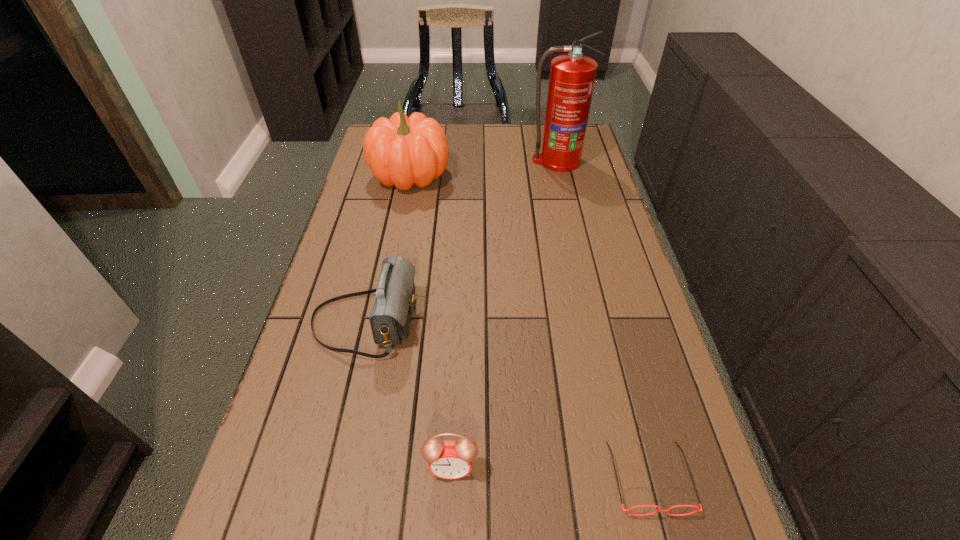
You are a GUI agent. You are given a task and a screenshot of the screen. Output one action in this format:
    pyautogui.click(x=<x>, y=<y>)
    Task: Click on the vacant space that's between the third farthest object and the second shortest object
    The image size is (960, 540).
    Given the screenshot: What is the action you would take?
    pyautogui.click(x=408, y=394)

Find the location of a particular element. This screenshot has height=540, width=960. free spot between the second tallest object and the fire extinguisher is located at coordinates (484, 168).

The width and height of the screenshot is (960, 540). Find the location of `object that is the third closest to the tallest object`. object that is the third closest to the tallest object is located at coordinates (657, 510).

The image size is (960, 540). Find the location of `object that can be found as the third closest to the second tallest object`. object that can be found as the third closest to the second tallest object is located at coordinates (450, 460).